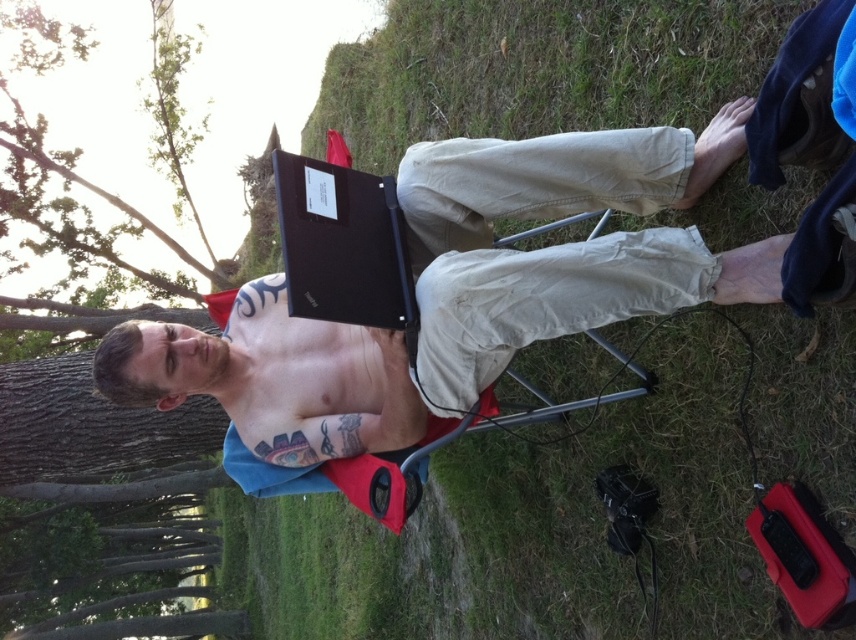
Between dark brown bark tree at upper left and shiny black laptop at center, which one is positioned higher?

Positioned higher is shiny black laptop at center.

Is dark brown bark tree at upper left wider than shiny black laptop at center?

Yes.

Measure the distance between dark brown bark tree at upper left and camera.

2.10 meters

What are the coordinates of `dark brown bark tree at upper left` in the screenshot? It's located at (92, 436).

Does matte black laptop at center appear on the right side of black matte laptop at center?

Yes, matte black laptop at center is to the right of black matte laptop at center.

Who is more forward, (x=642, y=234) or (x=367, y=176)?

Positioned in front is point (x=642, y=234).

Who is more forward, (x=278, y=468) or (x=361, y=224)?

Point (x=361, y=224) is in front.

Locate an element on the screen. matte black laptop at center is located at coordinates (458, 291).

Is matte black laptop at center positioned in front of shiny black laptop at center?

Yes, matte black laptop at center is in front of shiny black laptop at center.

Which is more to the left, matte black laptop at center or shiny black laptop at center?

From the viewer's perspective, shiny black laptop at center appears more on the left side.

At what (x,y) coordinates should I click in order to perform the action: click on matte black laptop at center. Please return your answer as a coordinate pair (x, y). The image size is (856, 640). Looking at the image, I should click on click(x=458, y=291).

You are a GUI agent. You are given a task and a screenshot of the screen. Output one action in this format:
    pyautogui.click(x=<x>, y=<y>)
    Task: Click on the matte black laptop at center
    
    Given the screenshot: What is the action you would take?
    pyautogui.click(x=458, y=291)